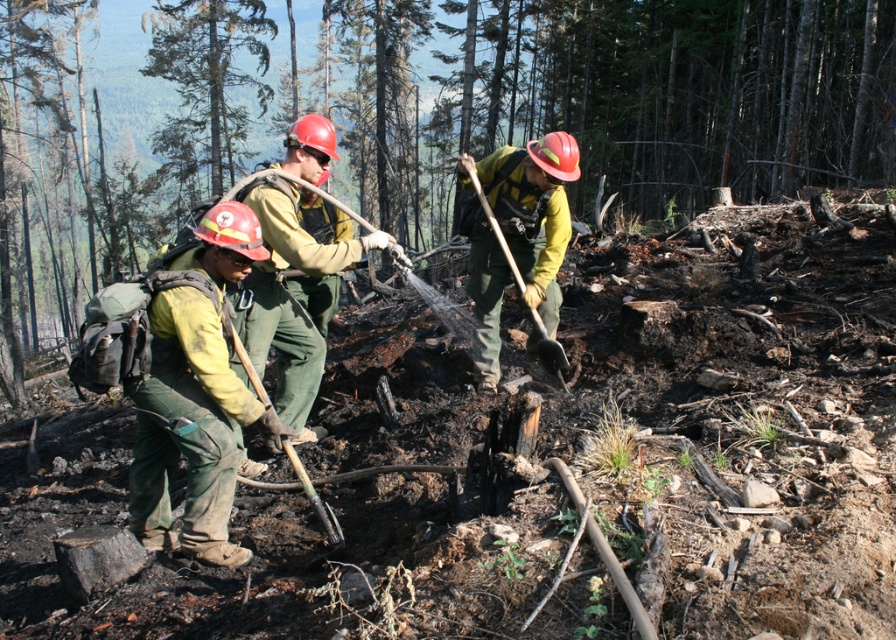
You are a firefighter assessing the area after a wildfire. You notice the charcoal ash stump at center and the green wooden shovel at lower center. Which object is positioned higher in the image?

The charcoal ash stump at center is located above the green wooden shovel at lower center, so it is positioned higher in the image.